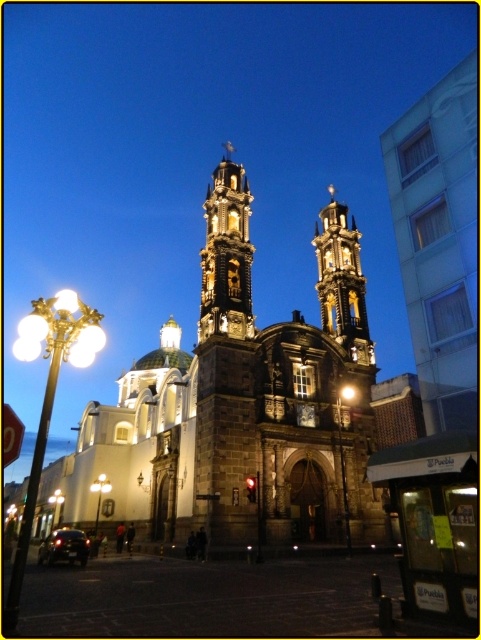
From the picture: Is golden ornate bell tower at center shorter than dark gray stone bell tower at center?

In fact, golden ornate bell tower at center may be taller than dark gray stone bell tower at center.

Is golden ornate bell tower at center to the left of dark gray stone bell tower at center from the viewer's perspective?

Indeed, golden ornate bell tower at center is positioned on the left side of dark gray stone bell tower at center.

The height and width of the screenshot is (640, 481). Describe the element at coordinates (227, 253) in the screenshot. I see `golden ornate bell tower at center` at that location.

I want to click on golden ornate bell tower at center, so click(227, 253).